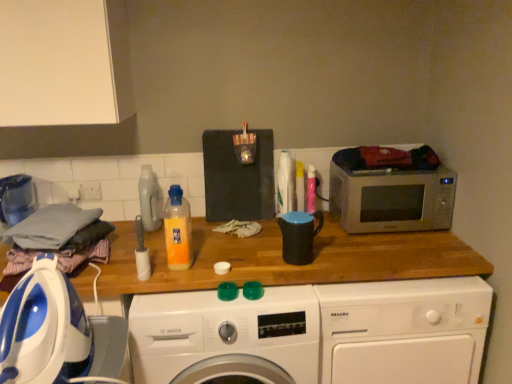
Locate an element on the screen. vacant area that lies in front of translucent orange liquid at center, which is the second bottle from left to right is located at coordinates (180, 303).